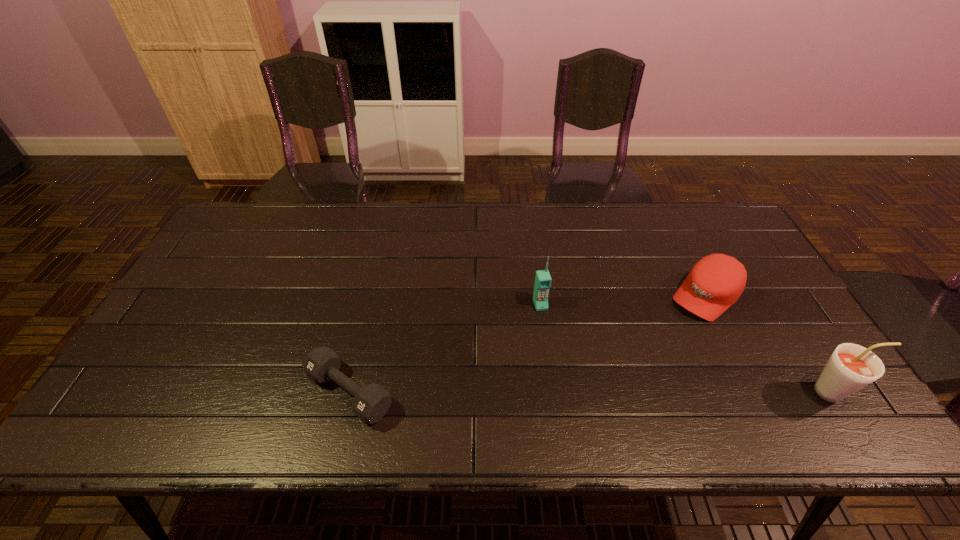
You are a GUI agent. You are given a task and a screenshot of the screen. Output one action in this format:
    pyautogui.click(x=<x>, y=<y>)
    Task: Click on the vacant area located 0.170m on the keypad of the cellular telephone
    The height and width of the screenshot is (540, 960).
    Given the screenshot: What is the action you would take?
    pyautogui.click(x=559, y=363)

Where is `free space located 0.130m on the keypad of the cellular telephone`? The height and width of the screenshot is (540, 960). free space located 0.130m on the keypad of the cellular telephone is located at coordinates (554, 350).

The width and height of the screenshot is (960, 540). Identify the location of free space located on the keypad of the cellular telephone. (549, 334).

Identify the location of dumbbell that is at the near edge. This screenshot has height=540, width=960. (372, 402).

I want to click on root beer located in the near edge section of the desktop, so click(851, 367).

The height and width of the screenshot is (540, 960). In order to click on root beer that is at the right edge in this screenshot , I will do `click(851, 367)`.

The height and width of the screenshot is (540, 960). Find the location of `cap present at the right edge`. cap present at the right edge is located at coordinates (715, 282).

At what (x,y) coordinates should I click in order to perform the action: click on object that is at the near right corner. Please return your answer as a coordinate pair (x, y). This screenshot has height=540, width=960. Looking at the image, I should click on (851, 367).

Where is `free space at the far edge of the desktop`? The width and height of the screenshot is (960, 540). free space at the far edge of the desktop is located at coordinates (503, 228).

I want to click on vacant area at the near edge, so click(x=300, y=392).